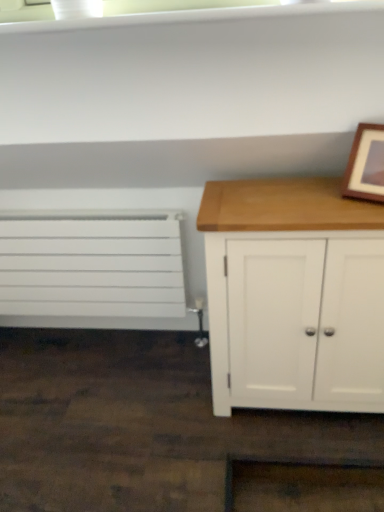
Identify the location of vacant space situated above white matte radiator at left (from a real-world perspective). This screenshot has width=384, height=512. (69, 214).